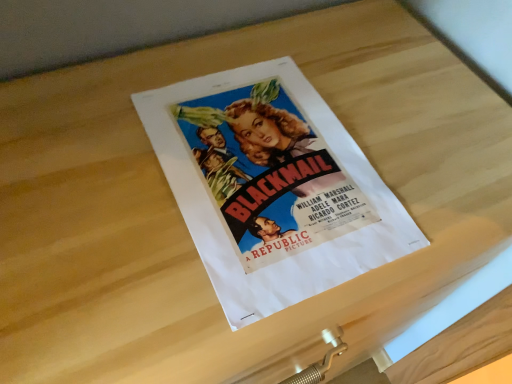
Find the location of a particular element. free point to the right of matte paper poster at center is located at coordinates (440, 178).